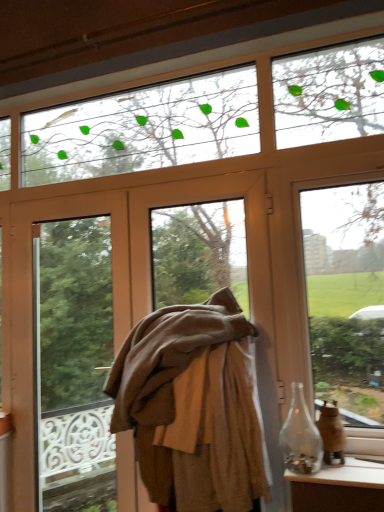
Question: Is brown fabric at center facing away from transparent glass bottle at lower right?

Choices:
 (A) yes
 (B) no

Answer: (B)

Question: From a real-world perspective, is brown fabric at center located beneath transparent glass bottle at lower right?

Choices:
 (A) no
 (B) yes

Answer: (A)

Question: Does brown fabric at center appear on the left side of transparent glass bottle at lower right?

Choices:
 (A) no
 (B) yes

Answer: (B)

Question: Is brown fabric at center far from transparent glass bottle at lower right?

Choices:
 (A) no
 (B) yes

Answer: (A)

Question: Would you say transparent glass bottle at lower right is part of brown fabric at center's contents?

Choices:
 (A) yes
 (B) no

Answer: (B)

Question: Is brown fabric at center closer to the viewer compared to transparent glass bottle at lower right?

Choices:
 (A) no
 (B) yes

Answer: (A)

Question: Considering the relative sizes of transparent glass window at upper right and brown woolen coat at center in the image provided, is transparent glass window at upper right bigger than brown woolen coat at center?

Choices:
 (A) yes
 (B) no

Answer: (B)

Question: Is transparent glass window at upper right wider than brown woolen coat at center?

Choices:
 (A) no
 (B) yes

Answer: (A)

Question: Can you confirm if transparent glass window at upper right is positioned to the left of brown woolen coat at center?

Choices:
 (A) no
 (B) yes

Answer: (A)

Question: From a real-world perspective, is transparent glass window at upper right located higher than brown woolen coat at center?

Choices:
 (A) no
 (B) yes

Answer: (B)

Question: Is transparent glass window at upper right surrounding brown woolen coat at center?

Choices:
 (A) no
 (B) yes

Answer: (A)

Question: Is transparent glass window at upper right shorter than brown woolen coat at center?

Choices:
 (A) yes
 (B) no

Answer: (B)

Question: Is translucent glass vase at right completely or partially outside of brown fabric at center?

Choices:
 (A) yes
 (B) no

Answer: (A)